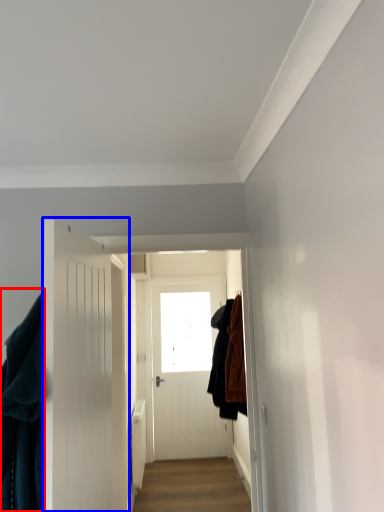
Question: Which of the following is the closest to the observer, clothing (highlighted by a red box) or door (highlighted by a blue box)?

Choices:
 (A) clothing
 (B) door

Answer: (B)